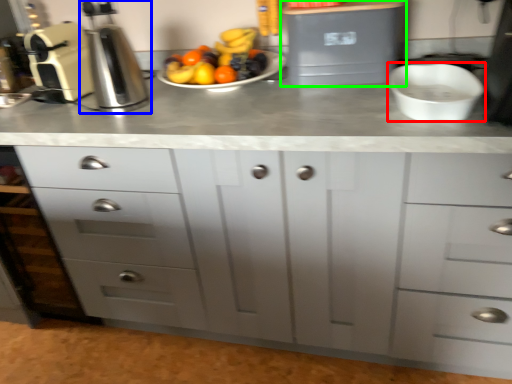
Question: Based on their relative distances, which object is farther from mixing bowl (highlighted by a red box)? Choose from coffee machine (highlighted by a blue box) and appliance (highlighted by a green box).

Choices:
 (A) coffee machine
 (B) appliance

Answer: (A)